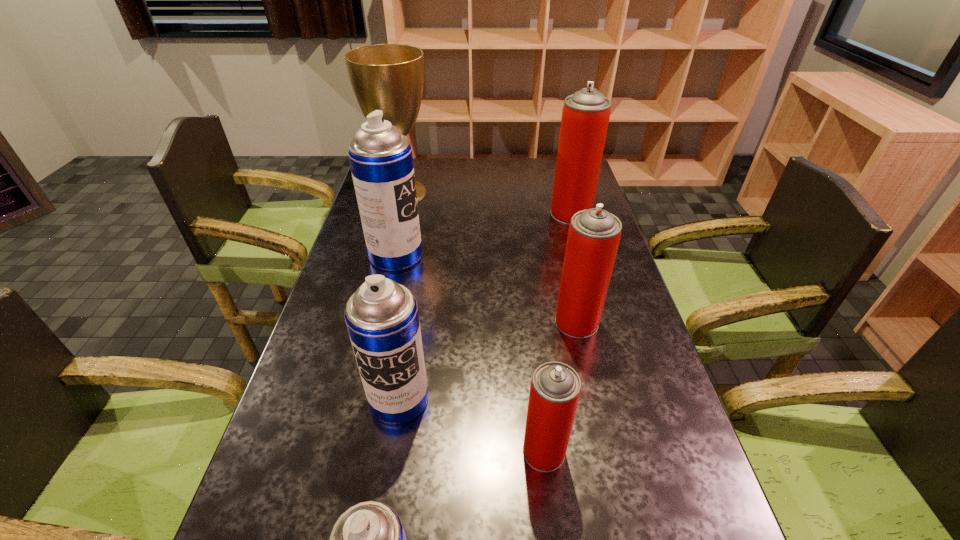
At what (x,y) coordinates should I click in order to perform the action: click on the fourth aerosol can from left to right. Please return your answer as a coordinate pair (x, y). This screenshot has height=540, width=960. Looking at the image, I should click on pyautogui.click(x=555, y=389).

At what (x,y) coordinates should I click in order to perform the action: click on vacant position located on the right of the trophy cup. Please return your answer as a coordinate pair (x, y). The image size is (960, 540). Looking at the image, I should click on (540, 192).

The image size is (960, 540). I want to click on blank space located 0.090m on the label side of the biggest blue aerosol can, so click(451, 255).

I want to click on vacant space located on the front of the farthest aerosol can, so click(x=583, y=256).

Locate an element on the screen. free space located 0.320m on the back of the second biggest red aerosol can is located at coordinates (558, 238).

Locate an element on the screen. This screenshot has height=540, width=960. vacant space located on the label side of the fifth farthest object is located at coordinates (379, 522).

Where is `vacant space located on the back of the smallest red aerosol can`? The height and width of the screenshot is (540, 960). vacant space located on the back of the smallest red aerosol can is located at coordinates (538, 399).

At what (x,y) coordinates should I click in order to perform the action: click on object that is at the far edge. Please return your answer as a coordinate pair (x, y). This screenshot has height=540, width=960. Looking at the image, I should click on (389, 77).

Where is `trophy cup present at the left edge`? trophy cup present at the left edge is located at coordinates (389, 77).

Locate an element on the screen. This screenshot has height=540, width=960. aerosol can at the left edge is located at coordinates (380, 157).